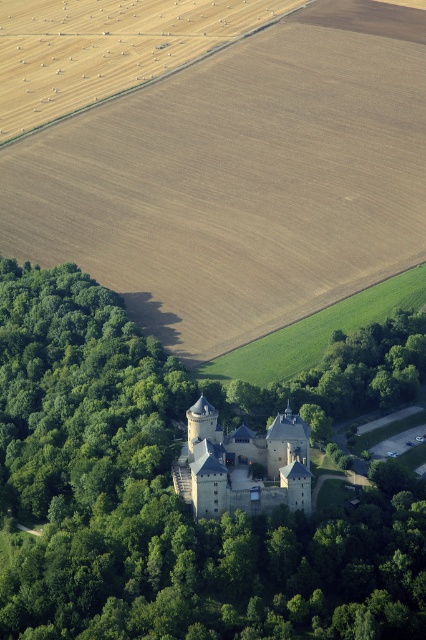
Question: Which point appears closest to the camera in this image?

Choices:
 (A) (199, 433)
 (B) (213, 518)

Answer: (B)

Question: Which object appears closest to the camera in this image?

Choices:
 (A) stone medieval castle at center
 (B) green leafy trees at center

Answer: (B)

Question: Can you confirm if green leafy trees at center is wider than stone medieval castle at center?

Choices:
 (A) yes
 (B) no

Answer: (A)

Question: Does green leafy trees at center appear on the left side of stone medieval castle at center?

Choices:
 (A) no
 (B) yes

Answer: (B)

Question: Is green leafy trees at center wider than stone medieval castle at center?

Choices:
 (A) yes
 (B) no

Answer: (A)

Question: Among these objects, which one is farthest from the camera?

Choices:
 (A) stone medieval castle at center
 (B) green leafy trees at center

Answer: (A)